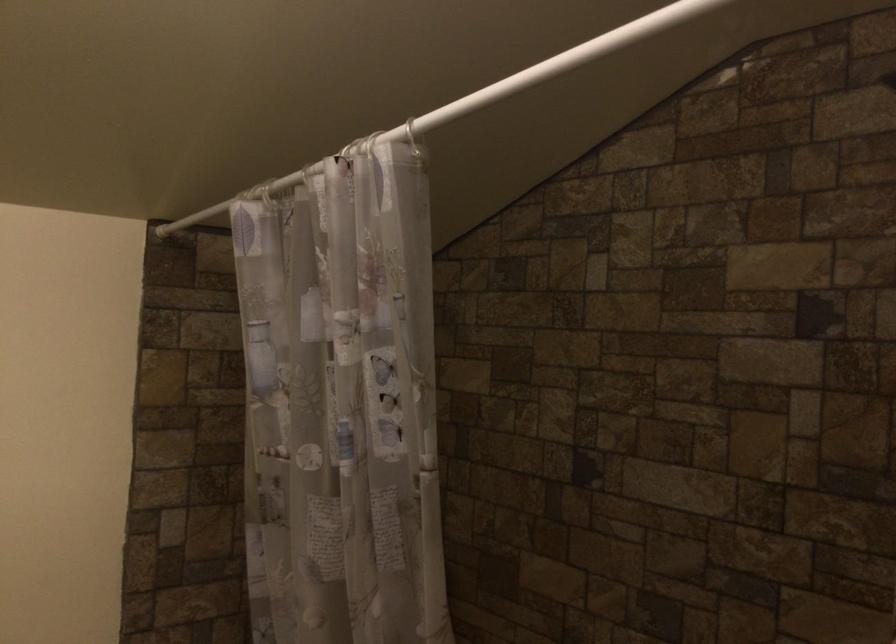
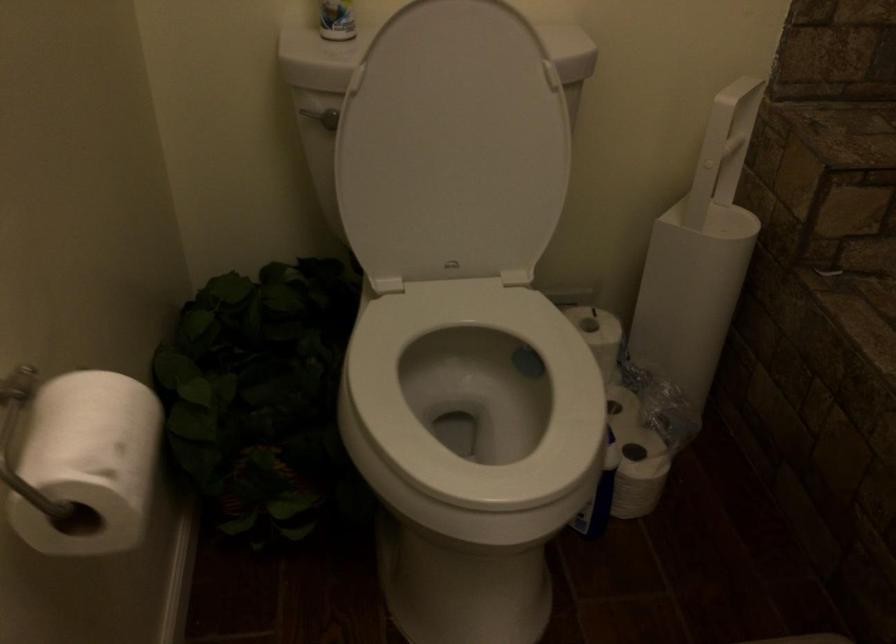
The images are taken continuously from a first-person perspective. In which direction is your viewpoint rotating?

The rotation direction of the camera is left-down.